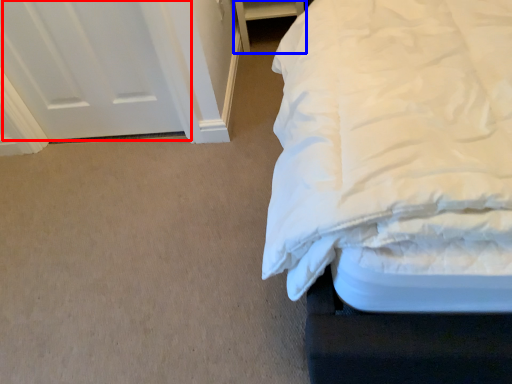
Question: Which of the following is the farthest to the observer, door (highlighted by a red box) or furniture (highlighted by a blue box)?

Choices:
 (A) door
 (B) furniture

Answer: (B)